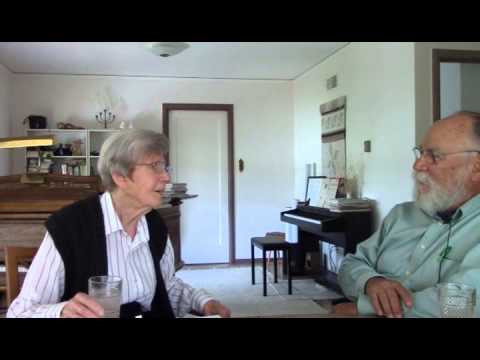
At what (x,y) coordinates should I click in order to perform the action: click on door. Please return your answer as a coordinate pair (x, y). The image size is (480, 360). Looking at the image, I should click on (202, 161).